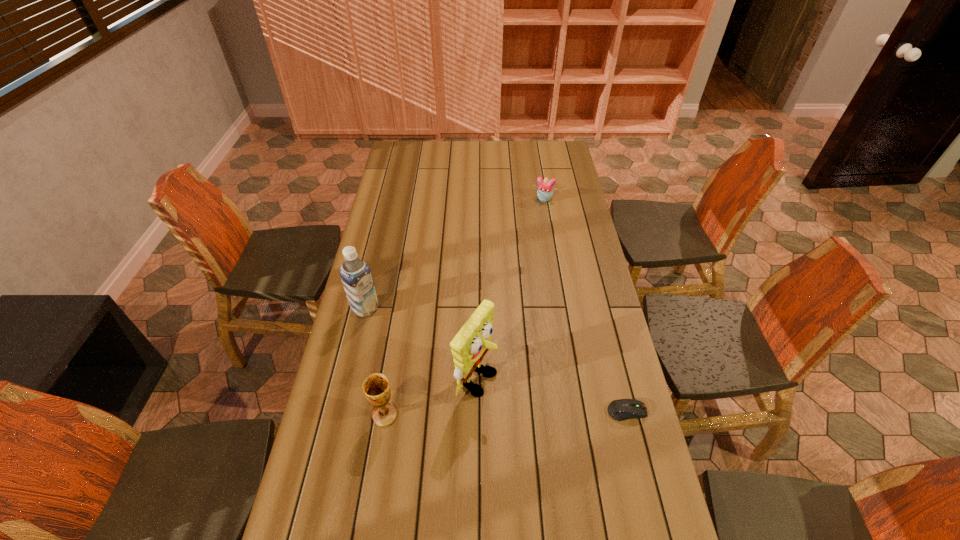
Where is `vacant area that lies between the soya milk and the third object from right to left`? The image size is (960, 540). vacant area that lies between the soya milk and the third object from right to left is located at coordinates (420, 343).

Find the location of `vacant space that is in between the third shortest object and the sponge`. vacant space that is in between the third shortest object and the sponge is located at coordinates (430, 396).

The image size is (960, 540). What are the coordinates of `free space between the second object from left to right and the shortest object` in the screenshot? It's located at (506, 413).

This screenshot has height=540, width=960. I want to click on free spot between the shortest object and the leftmost object, so click(x=496, y=360).

At what (x,y) coordinates should I click in order to perform the action: click on vacant space that is in between the chalice and the shortest object. Please return your answer as a coordinate pair (x, y). Looking at the image, I should click on (506, 413).

In order to click on empty space between the sponge and the fourth tallest object in this screenshot , I will do `click(510, 288)`.

Select which object is the second closest to the fourth tallest object. Please provide its 2D coordinates. Your answer should be formatted as a tuple, i.e. [(x, y)], where the tuple contains the x and y coordinates of a point satisfying the conditions above.

[(469, 346)]

Identify the location of object that can be found as the third closest to the sponge. (623, 409).

In order to click on free point that satisfies the following two spatial constraints: 1. on the front side of the third object from right to left; 2. on the button of the computer equipment in this screenshot , I will do `click(476, 411)`.

Where is `vacant area in the image that satisfies the following two spatial constraints: 1. on the back side of the computer equipment; 2. on the button of the chalice`? vacant area in the image that satisfies the following two spatial constraints: 1. on the back side of the computer equipment; 2. on the button of the chalice is located at coordinates (386, 411).